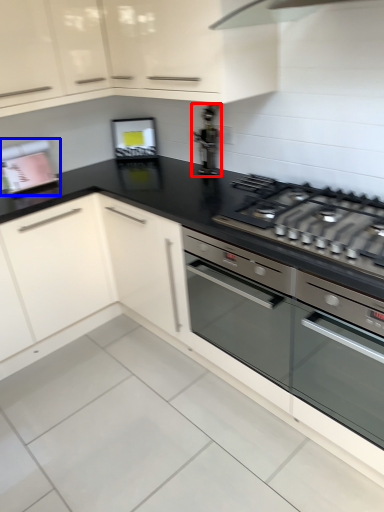
Question: Which of the following is the farthest to the observer, appliance (highlighted by a red box) or appliance (highlighted by a blue box)?

Choices:
 (A) appliance
 (B) appliance

Answer: (B)